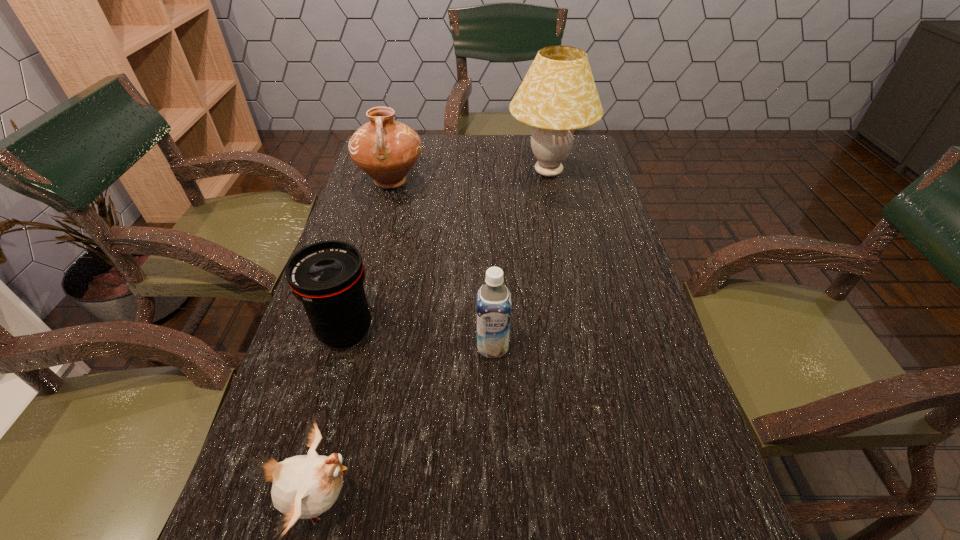
Where is `pottery at the far edge`? pottery at the far edge is located at coordinates (386, 150).

This screenshot has width=960, height=540. What are the coordinates of `pottery situated at the left edge` in the screenshot? It's located at (386, 150).

Locate an element on the screen. telephoto lens at the left edge is located at coordinates [327, 277].

Where is `object situated at the right edge`? Image resolution: width=960 pixels, height=540 pixels. object situated at the right edge is located at coordinates coord(558,94).

Where is `object that is at the far left corner`? This screenshot has height=540, width=960. object that is at the far left corner is located at coordinates (386, 150).

Locate an element on the screen. The height and width of the screenshot is (540, 960). object at the far right corner is located at coordinates (558, 94).

Locate an element on the screen. Image resolution: width=960 pixels, height=540 pixels. vacant area at the far edge is located at coordinates click(445, 146).

In the image, there is a desktop. Where is `free space at the left edge`? free space at the left edge is located at coordinates (281, 444).

At what (x,y) coordinates should I click in order to perform the action: click on vacant space at the right edge of the desktop. Please return your answer as a coordinate pair (x, y). The height and width of the screenshot is (540, 960). Looking at the image, I should click on (552, 178).

This screenshot has width=960, height=540. In order to click on vacant space at the far right corner of the desktop in this screenshot , I will do `click(581, 160)`.